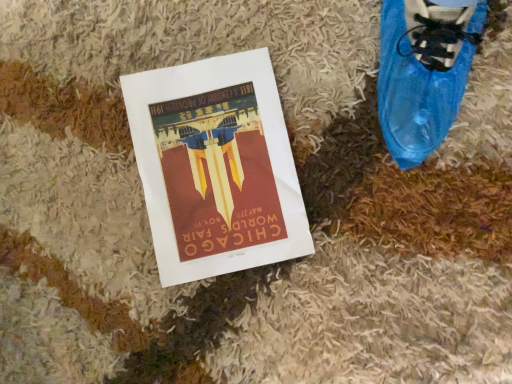
Question: Should I look upward or downward to see matte paper poster at center?

Choices:
 (A) down
 (B) up

Answer: (B)